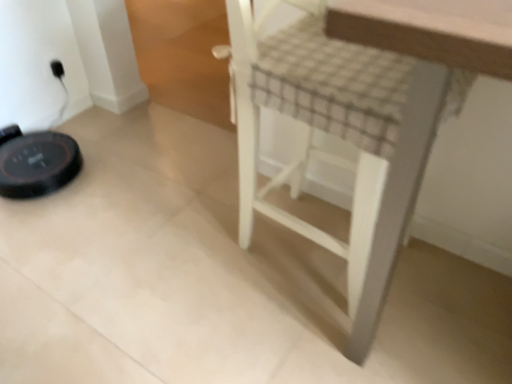
Identify the location of vacant space underneath white wood stool at center (from a real-world perspective). (303, 250).